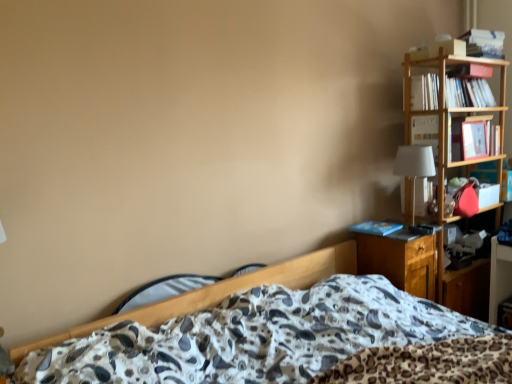
Question: Considering the relative positions of wooden nightstand at right and white paper book at upper right, the 3th book ordered from the bottom, in the image provided, is wooden nightstand at right to the right of white paper book at upper right, the 3th book ordered from the bottom, from the viewer's perspective?

Choices:
 (A) yes
 (B) no

Answer: (B)

Question: Considering the relative sizes of wooden nightstand at right and white paper book at upper right, marked as the 2th book in a top-to-bottom arrangement, in the image provided, is wooden nightstand at right taller than white paper book at upper right, marked as the 2th book in a top-to-bottom arrangement,?

Choices:
 (A) no
 (B) yes

Answer: (B)

Question: Is wooden nightstand at right looking in the opposite direction of white paper book at upper right, the 3th book ordered from the bottom?

Choices:
 (A) no
 (B) yes

Answer: (A)

Question: From the image's perspective, is wooden nightstand at right beneath white paper book at upper right, marked as the 2th book in a top-to-bottom arrangement?

Choices:
 (A) no
 (B) yes

Answer: (B)

Question: Does wooden nightstand at right have a lesser height compared to white paper book at upper right, marked as the 2th book in a top-to-bottom arrangement?

Choices:
 (A) yes
 (B) no

Answer: (B)

Question: Is wooden nightstand at right positioned behind white paper book at upper right, marked as the 2th book in a top-to-bottom arrangement?

Choices:
 (A) yes
 (B) no

Answer: (B)

Question: Is wooden nightstand at right with white fabric lampshade at right?

Choices:
 (A) yes
 (B) no

Answer: (B)

Question: Considering the relative sizes of wooden nightstand at right and white fabric lampshade at right in the image provided, is wooden nightstand at right shorter than white fabric lampshade at right?

Choices:
 (A) no
 (B) yes

Answer: (A)

Question: Is wooden nightstand at right positioned beyond the bounds of white fabric lampshade at right?

Choices:
 (A) yes
 (B) no

Answer: (A)

Question: Is wooden nightstand at right aimed at white fabric lampshade at right?

Choices:
 (A) no
 (B) yes

Answer: (A)

Question: From the image's perspective, is wooden nightstand at right above white fabric lampshade at right?

Choices:
 (A) no
 (B) yes

Answer: (A)

Question: Does wooden nightstand at right have a lesser width compared to white fabric lampshade at right?

Choices:
 (A) yes
 (B) no

Answer: (B)

Question: Does white fabric lampshade at right have a smaller size compared to hardcover book at upper right, the 2th book positioned from the bottom?

Choices:
 (A) yes
 (B) no

Answer: (B)